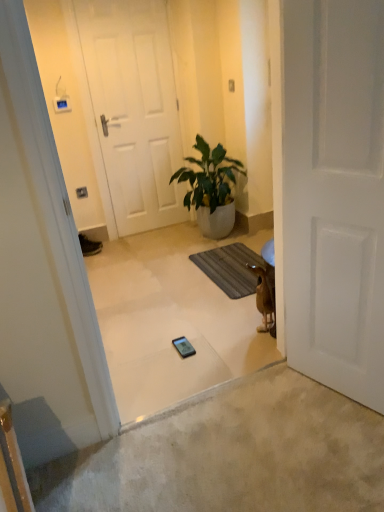
The image size is (384, 512). I want to click on vacant location behind brown furry dog at lower right, so click(x=246, y=313).